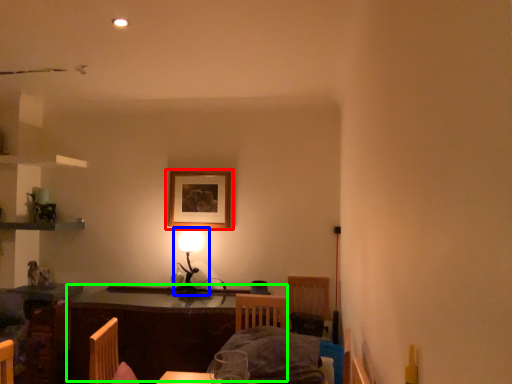
Question: Considering the real-world distances, which object is closest to picture frame (highlighted by a red box)? table lamp (highlighted by a blue box) or table (highlighted by a green box).

Choices:
 (A) table lamp
 (B) table

Answer: (A)